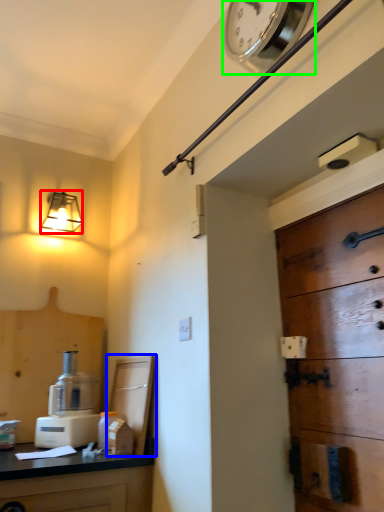
Question: Based on their relative distances, which object is nearer to lamp (highlighted by a red box)? Choose from cabinetry (highlighted by a blue box) and clock (highlighted by a green box).

Choices:
 (A) cabinetry
 (B) clock

Answer: (A)